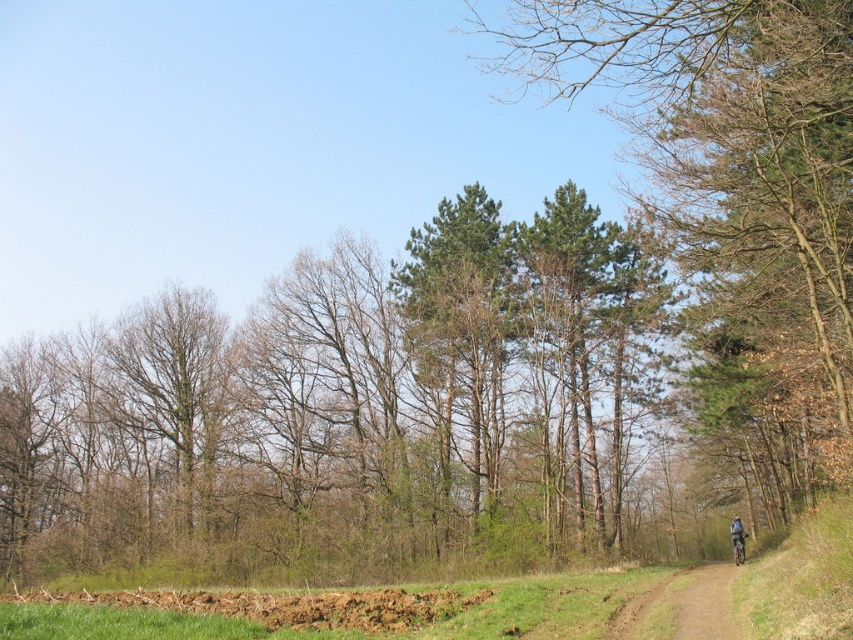
Question: Which of these objects is positioned closest to the shiny blue frame at right?

Choices:
 (A) brown dirt track at lower right
 (B) green leafy tree at center

Answer: (A)

Question: Which object appears closest to the camera in this image?

Choices:
 (A) green leafy tree at center
 (B) brown dirt track at lower right

Answer: (A)

Question: In this image, where is green leafy tree at center located relative to brown dirt track at lower right?

Choices:
 (A) above
 (B) below

Answer: (A)

Question: Is green leafy tree at center smaller than shiny blue frame at right?

Choices:
 (A) yes
 (B) no

Answer: (B)

Question: Which object is farther from the camera taking this photo?

Choices:
 (A) shiny blue frame at right
 (B) brown dirt track at lower right
 (C) green leafy tree at center

Answer: (A)

Question: Where is brown dirt track at lower right located in relation to shiny blue frame at right in the image?

Choices:
 (A) left
 (B) right

Answer: (A)